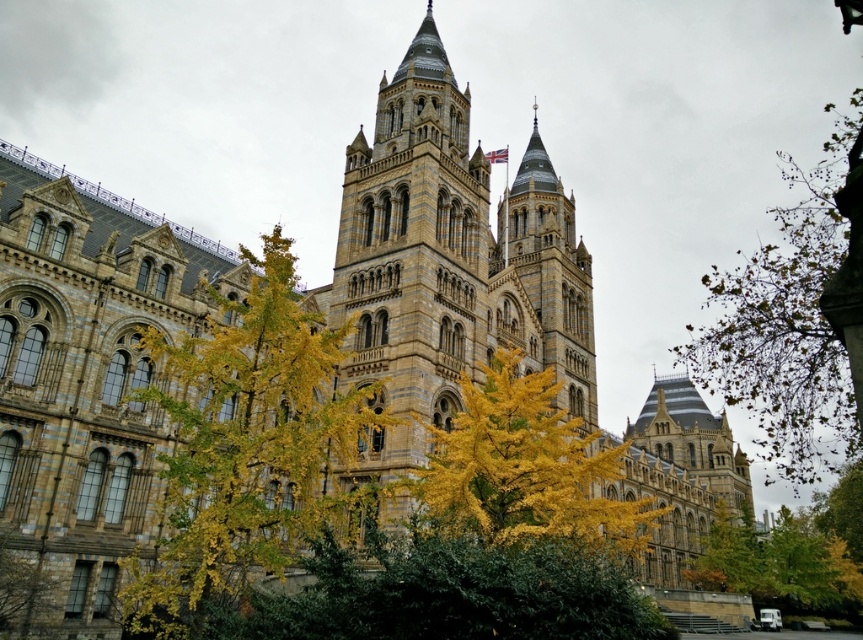
Does brown stone tower at center appear on the right side of yellow leafy tree at lower right?

Incorrect, brown stone tower at center is not on the right side of yellow leafy tree at lower right.

Who is higher up, brown stone tower at center or yellow leafy tree at lower right?

Positioned higher is brown stone tower at center.

Who is more distant from viewer, (x=401, y=371) or (x=763, y=541)?

Point (x=763, y=541)

At what (x,y) coordinates should I click in order to perform the action: click on brown stone tower at center. Please return your answer as a coordinate pair (x, y). Image resolution: width=863 pixels, height=640 pixels. Looking at the image, I should click on pos(452,252).

The height and width of the screenshot is (640, 863). What do you see at coordinates (249, 451) in the screenshot?
I see `yellow-green leaves at center` at bounding box center [249, 451].

Can you confirm if yellow-green leaves at center is positioned below yellow leafy tree at center?

Actually, yellow-green leaves at center is above yellow leafy tree at center.

Is point (135, 616) positioned before point (490, 406)?

Yes, it is.

The image size is (863, 640). What are the coordinates of `yellow-green leaves at center` in the screenshot? It's located at (249, 451).

Is yellow leafy tree at center in front of yellow leafy tree at lower right?

Yes, yellow leafy tree at center is closer to the viewer.

Which is more to the left, yellow leafy tree at center or yellow leafy tree at lower right?

yellow leafy tree at center

Image resolution: width=863 pixels, height=640 pixels. In order to click on yellow leafy tree at center in this screenshot , I will do `click(526, 468)`.

Locate an element on the screen. yellow leafy tree at center is located at coordinates (526, 468).